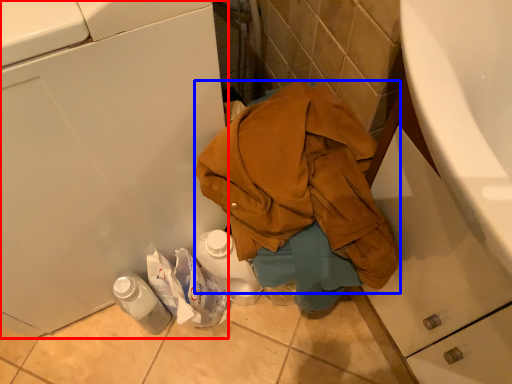
Question: Among these objects, which one is farthest to the camera, washing machine (highlighted by a red box) or waste (highlighted by a blue box)?

Choices:
 (A) washing machine
 (B) waste

Answer: (B)